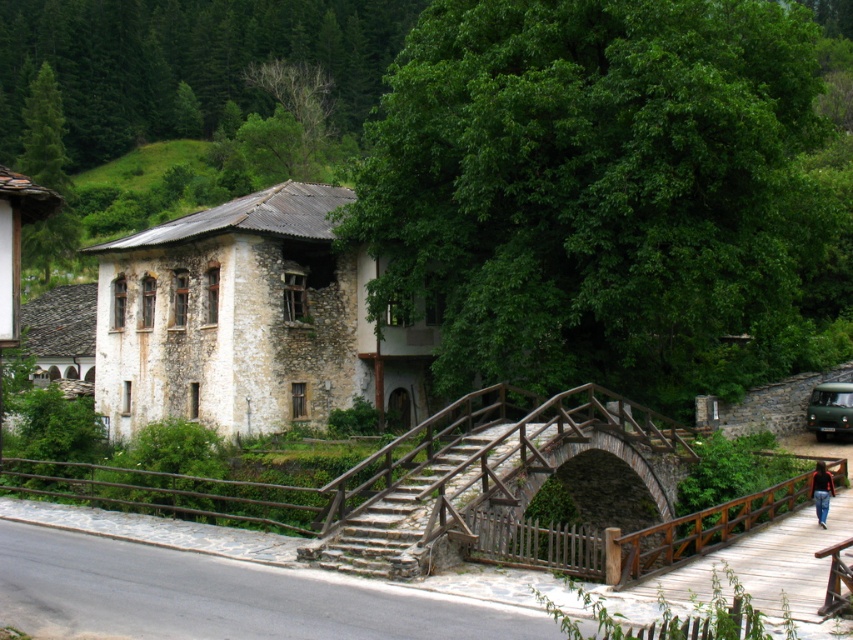
Question: Is stone/stained wood stairs at center smaller than green matte van at right?

Choices:
 (A) yes
 (B) no

Answer: (A)

Question: Which point appears closest to the camera in this image?

Choices:
 (A) (494, 428)
 (B) (820, 396)
 (C) (819, 488)

Answer: (C)

Question: Which point is farther from the camera taking this photo?

Choices:
 (A) (846, 396)
 (B) (511, 460)
 (C) (814, 497)
 (D) (412, 509)

Answer: (A)

Question: In this image, where is wooden bridge at center located relative to stone/stained wood stairs at center?

Choices:
 (A) below
 (B) above

Answer: (A)

Question: Which of the following is the closest to the observer?

Choices:
 (A) pyautogui.click(x=459, y=452)
 (B) pyautogui.click(x=839, y=429)

Answer: (A)

Question: Is wooden bridge at center closer to the viewer compared to black fabric jacket at lower right?

Choices:
 (A) no
 (B) yes

Answer: (B)